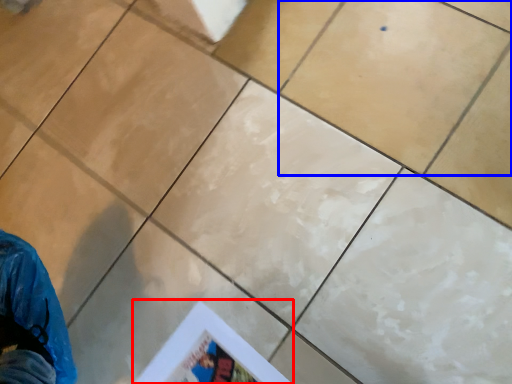
Question: Among these objects, which one is nearest to the camera, poster page (highlighted by a red box) or ceramic tile (highlighted by a blue box)?

Choices:
 (A) poster page
 (B) ceramic tile

Answer: (A)